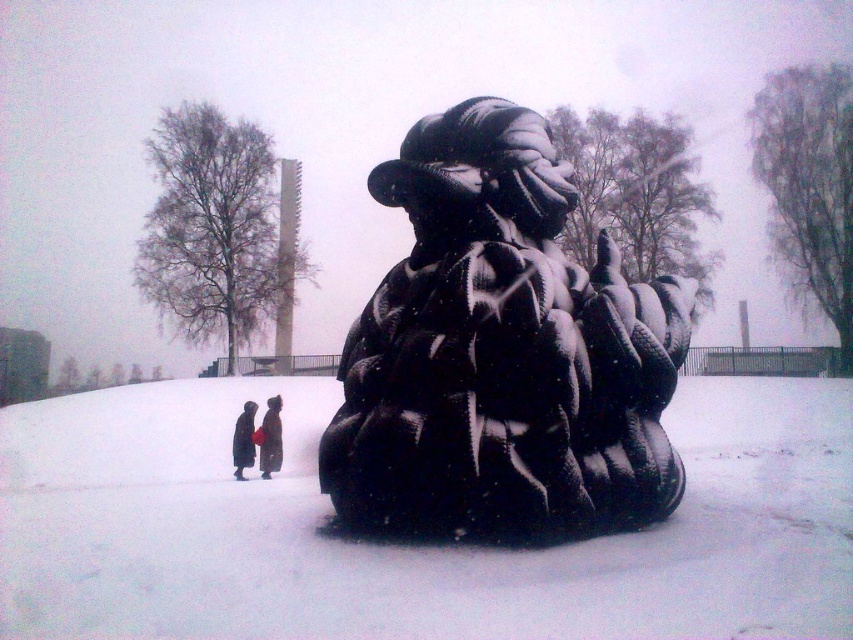
Can you confirm if sculpture at center is taller than dark brown fur coat at lower center?

Correct, sculpture at center is much taller as dark brown fur coat at lower center.

Between point (543, 394) and point (268, 400), which one is positioned in front?

Positioned in front is point (543, 394).

The width and height of the screenshot is (853, 640). Find the location of `sculpture at center`. sculpture at center is located at coordinates (502, 353).

Can you confirm if white matte snow at center is bigger than dark brown coat at center?

Indeed, white matte snow at center has a larger size compared to dark brown coat at center.

At what (x,y) coordinates should I click in order to perform the action: click on white matte snow at center. Please return your answer as a coordinate pair (x, y). This screenshot has height=640, width=853. Looking at the image, I should click on (409, 545).

From the picture: Can you confirm if white matte snow at center is positioned below sculpture at center?

Correct, white matte snow at center is located below sculpture at center.

Who is lower down, white matte snow at center or sculpture at center?

white matte snow at center is lower down.

Between point (579, 589) and point (471, 168), which one is positioned behind?

Positioned behind is point (471, 168).

I want to click on white matte snow at center, so click(x=409, y=545).